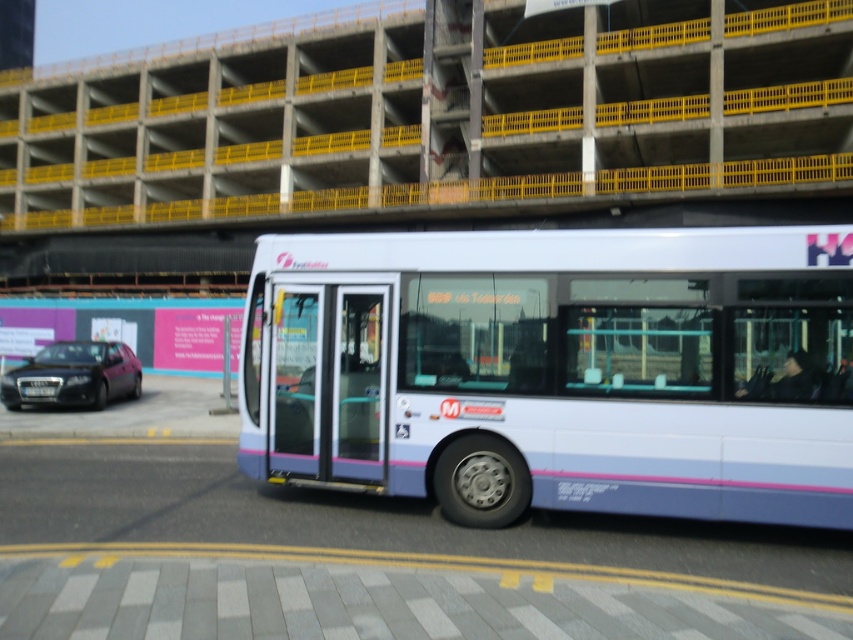
Question: Is white glossy bus at center to the left of shiny black sedan at left from the viewer's perspective?

Choices:
 (A) yes
 (B) no

Answer: (B)

Question: Can you confirm if white glossy bus at center is positioned to the right of shiny black sedan at left?

Choices:
 (A) no
 (B) yes

Answer: (B)

Question: Where is concrete/yellow-railings overpass at upper center located in relation to shiny black sedan at left in the image?

Choices:
 (A) left
 (B) right

Answer: (B)

Question: Which object is the farthest from the white glossy bus at center?

Choices:
 (A) concrete/yellow-railings overpass at upper center
 (B) shiny black sedan at left

Answer: (A)

Question: Which object is the farthest from the white glossy bus at center?

Choices:
 (A) shiny black sedan at left
 (B) concrete/yellow-railings overpass at upper center

Answer: (B)

Question: Which object appears closest to the camera in this image?

Choices:
 (A) concrete/yellow-railings overpass at upper center
 (B) white glossy bus at center

Answer: (B)